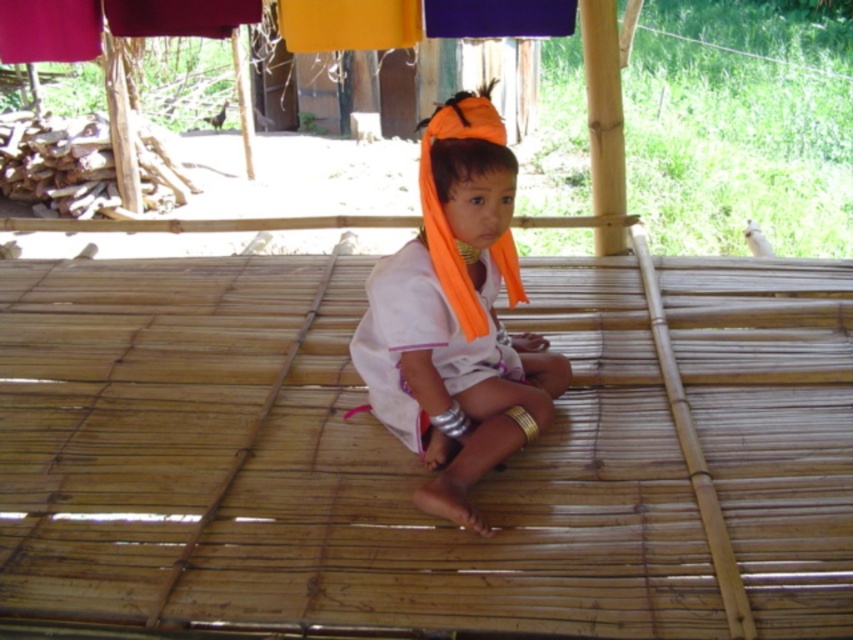
You are a photographer trying to capture the orange fabric headband at center in the image. The camera you are using has a focus point at coordinate point (456,317). Will this focus point help you capture the orange fabric headband at center?

The point (456,317) indicates orange fabric headband at center, so yes, the focus point at coordinate point (456,317) will help you capture the orange fabric headband at center.

The child is wearing an orange fabric headband at center and a white cotton robe at center. Which of these items is positioned higher on the child?

The orange fabric headband at center is much taller than the white cotton robe at center, so the orange fabric headband at center is positioned higher on the child.